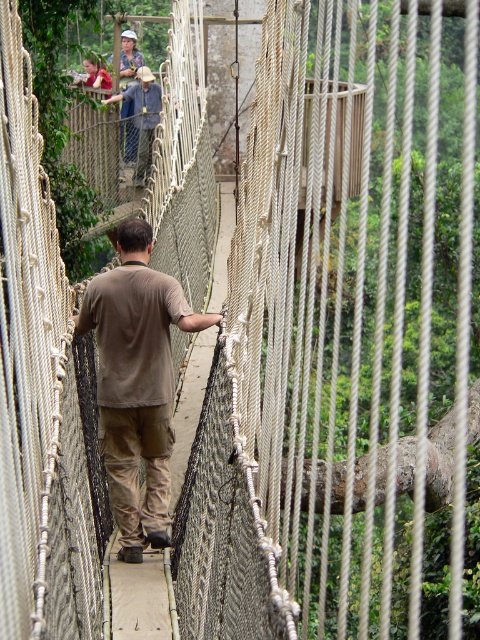
Based on the photo, is brown cotton shirt at center above matte khaki shirt at upper center?

No.

Does brown cotton shirt at center appear on the left side of matte khaki shirt at upper center?

In fact, brown cotton shirt at center is to the right of matte khaki shirt at upper center.

The width and height of the screenshot is (480, 640). Identify the location of brown cotton shirt at center. tap(136, 381).

You are a GUI agent. You are given a task and a screenshot of the screen. Output one action in this format:
    pyautogui.click(x=<x>, y=<y>)
    Task: Click on the denim jacket at upper center
    The image size is (480, 640).
    Given the screenshot: What is the action you would take?
    pyautogui.click(x=143, y=116)

Does denim jacket at upper center have a greater width compared to matte khaki shirt at upper center?

No, denim jacket at upper center is not wider than matte khaki shirt at upper center.

Is point (146, 156) farther from camera compared to point (87, 76)?

That is False.

Image resolution: width=480 pixels, height=640 pixels. In order to click on denim jacket at upper center in this screenshot , I will do `click(143, 116)`.

Can you confirm if brown cotton shirt at center is positioned above denim jacket at upper center?

No, brown cotton shirt at center is not above denim jacket at upper center.

Does brown cotton shirt at center have a greater height compared to denim jacket at upper center?

No, brown cotton shirt at center is not taller than denim jacket at upper center.

Is point (134, 477) positioned in front of point (145, 141)?

Yes, it is.

This screenshot has height=640, width=480. Find the location of `brown cotton shirt at center`. brown cotton shirt at center is located at coordinates (136, 381).